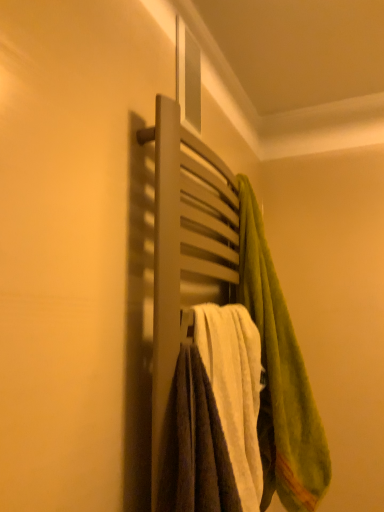
Question: Is green fuzzy towel at upper right, acting as the 1th towel starting from the right, touching matte wooden towel rack at center?

Choices:
 (A) no
 (B) yes

Answer: (A)

Question: Does green fuzzy towel at upper right, acting as the second towel starting from the left, have a greater height compared to matte wooden towel rack at center?

Choices:
 (A) yes
 (B) no

Answer: (A)

Question: Is green fuzzy towel at upper right, acting as the second towel starting from the left, thinner than matte wooden towel rack at center?

Choices:
 (A) yes
 (B) no

Answer: (B)

Question: Does green fuzzy towel at upper right, acting as the second towel starting from the left, have a lesser height compared to matte wooden towel rack at center?

Choices:
 (A) no
 (B) yes

Answer: (A)

Question: Is green fuzzy towel at upper right, acting as the second towel starting from the left, facing away from matte wooden towel rack at center?

Choices:
 (A) no
 (B) yes

Answer: (B)

Question: Is matte wooden towel rack at center taller or shorter than green fuzzy towel at upper right, acting as the 1th towel starting from the right?

Choices:
 (A) tall
 (B) short

Answer: (B)

Question: From a real-world perspective, is matte wooden towel rack at center positioned above or below green fuzzy towel at upper right, acting as the 1th towel starting from the right?

Choices:
 (A) below
 (B) above

Answer: (B)

Question: From the image's perspective, is matte wooden towel rack at center above or below green fuzzy towel at upper right, acting as the second towel starting from the left?

Choices:
 (A) above
 (B) below

Answer: (A)

Question: In terms of size, does matte wooden towel rack at center appear bigger or smaller than green fuzzy towel at upper right, acting as the 1th towel starting from the right?

Choices:
 (A) small
 (B) big

Answer: (B)

Question: Looking at their shapes, would you say green fuzzy towel at upper right, acting as the 1th towel starting from the right, is wider or thinner than matte wooden towel rack at center?

Choices:
 (A) wide
 (B) thin

Answer: (A)

Question: Considering their positions, is green fuzzy towel at upper right, acting as the second towel starting from the left, located in front of or behind matte wooden towel rack at center?

Choices:
 (A) behind
 (B) front

Answer: (A)

Question: Based on their sizes in the image, would you say green fuzzy towel at upper right, acting as the 1th towel starting from the right, is bigger or smaller than matte wooden towel rack at center?

Choices:
 (A) small
 (B) big

Answer: (A)

Question: Is green fuzzy towel at upper right, acting as the second towel starting from the left, inside the boundaries of matte wooden towel rack at center, or outside?

Choices:
 (A) inside
 (B) outside

Answer: (B)

Question: Considering the relative positions of white soft towel at center, marked as the first towel in a left-to-right arrangement, and green fuzzy towel at upper right, acting as the second towel starting from the left, in the image provided, is white soft towel at center, marked as the first towel in a left-to-right arrangement, to the left or to the right of green fuzzy towel at upper right, acting as the second towel starting from the left,?

Choices:
 (A) right
 (B) left

Answer: (B)

Question: From a real-world perspective, relative to green fuzzy towel at upper right, acting as the 1th towel starting from the right, is white soft towel at center, acting as the 2th towel starting from the right, vertically above or below?

Choices:
 (A) above
 (B) below

Answer: (B)